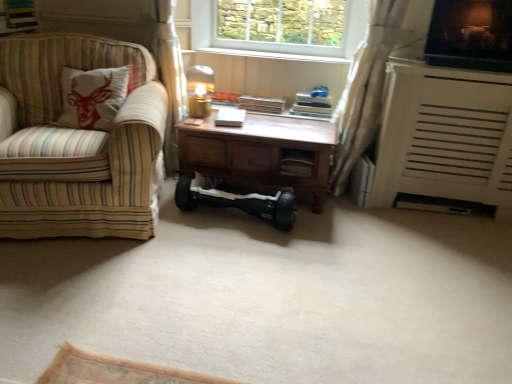
Question: Considering the positions of black rubber hoverboard at center and white textured heater at right in the image, is black rubber hoverboard at center taller or shorter than white textured heater at right?

Choices:
 (A) short
 (B) tall

Answer: (A)

Question: In the image, is black rubber hoverboard at center positioned in front of or behind white textured heater at right?

Choices:
 (A) front
 (B) behind

Answer: (A)

Question: Which object is positioned farthest from the white sheer curtain at right?

Choices:
 (A) wooden desk at center
 (B) white wood at upper center
 (C) metallic gold table lamp at center
 (D) wooden drawer at center
 (E) striped fabric couch at left

Answer: (E)

Question: Estimate the real-world distances between objects in this image. Which object is closer to the black rubber hoverboard at center?

Choices:
 (A) wooden drawer at center
 (B) wooden desk at center
 (C) black rubber hoverboard at center
 (D) white textured heater at right
 (E) white sheer curtain at right

Answer: (C)